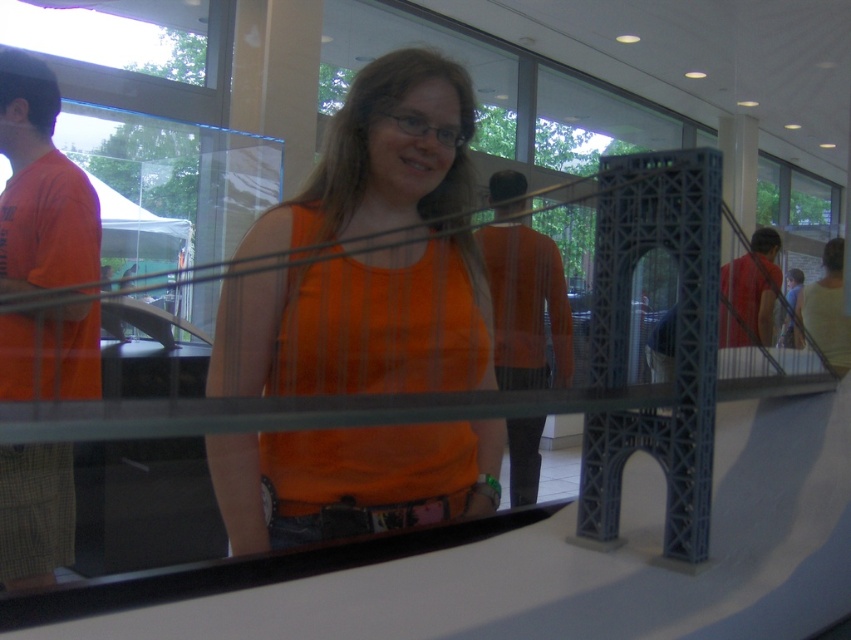
Can you confirm if orange fabric shirt at center is positioned to the left of matte red shirt at center?

Indeed, orange fabric shirt at center is positioned on the left side of matte red shirt at center.

Which is behind, point (528, 483) or point (758, 298)?

The point (758, 298) is more distant.

The height and width of the screenshot is (640, 851). I want to click on orange fabric shirt at center, so click(x=524, y=292).

Can you confirm if orange matte tank top at center is wider than matte red shirt at center?

Incorrect, orange matte tank top at center's width does not surpass matte red shirt at center's.

Is orange matte tank top at center thinner than matte red shirt at center?

Yes, orange matte tank top at center is thinner than matte red shirt at center.

Does point (280, 314) lie behind point (718, 326)?

No, it is not.

The height and width of the screenshot is (640, 851). I want to click on orange matte tank top at center, so click(x=368, y=253).

Is orange matte tank top at center taller than orange fabric shirt at center?

No.

Describe the element at coordinates (368, 253) in the screenshot. The image size is (851, 640). I see `orange matte tank top at center` at that location.

Is point (340, 348) less distant than point (526, 339)?

Yes, point (340, 348) is closer to viewer.

What are the coordinates of `orange matte tank top at center` in the screenshot? It's located at (368, 253).